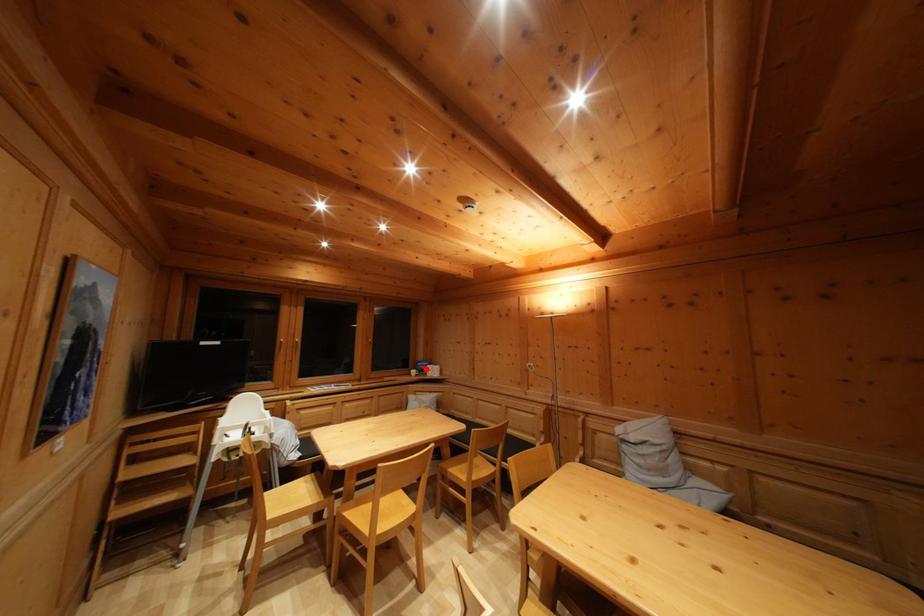
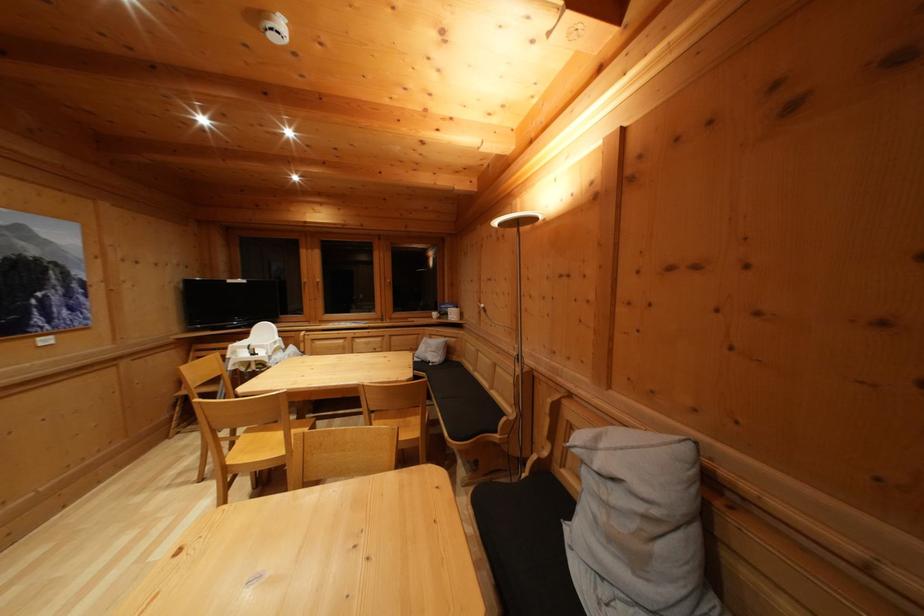
The point at the highlighted location is marked in the first image. Where is the corresponding point in the second image?

(450, 310)